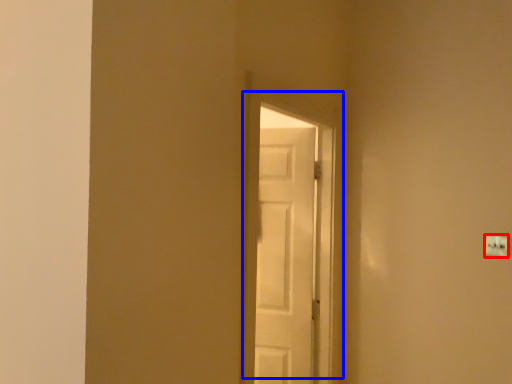
Question: Which object appears closest to the camera in this image, light switch (highlighted by a red box) or door (highlighted by a blue box)?

Choices:
 (A) light switch
 (B) door

Answer: (B)